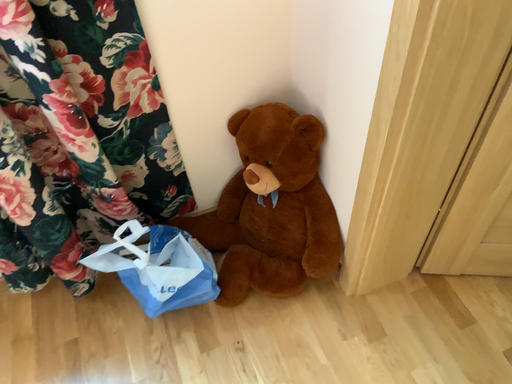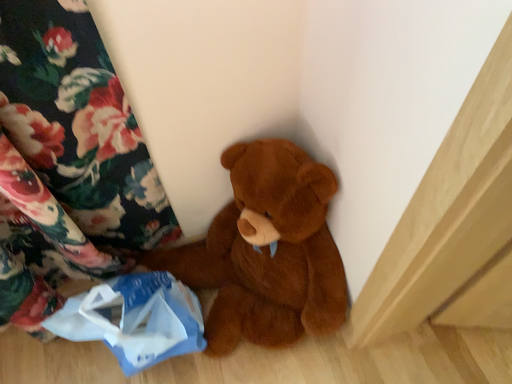
Question: How did the camera likely rotate when shooting the video?

Choices:
 (A) rotated upward
 (B) rotated downward

Answer: (B)